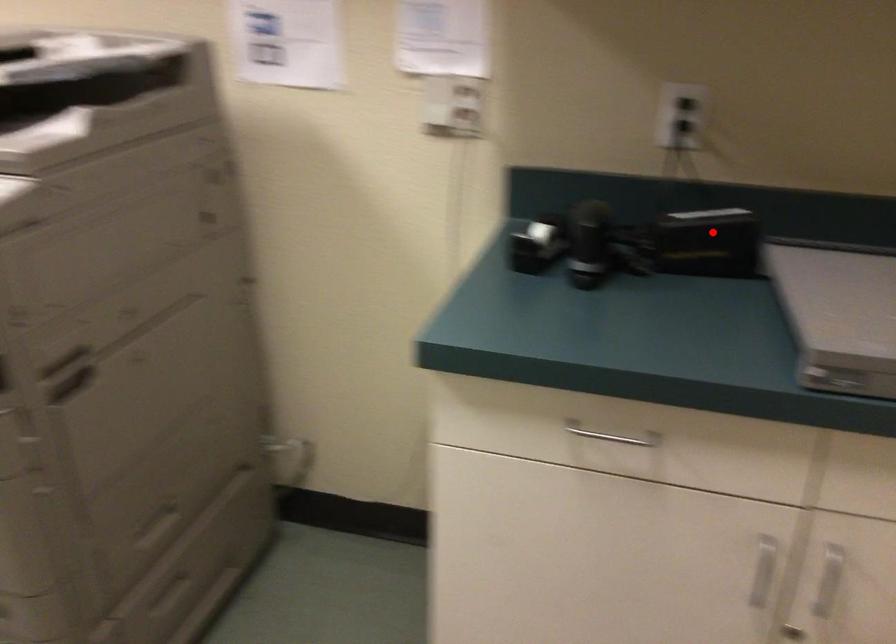
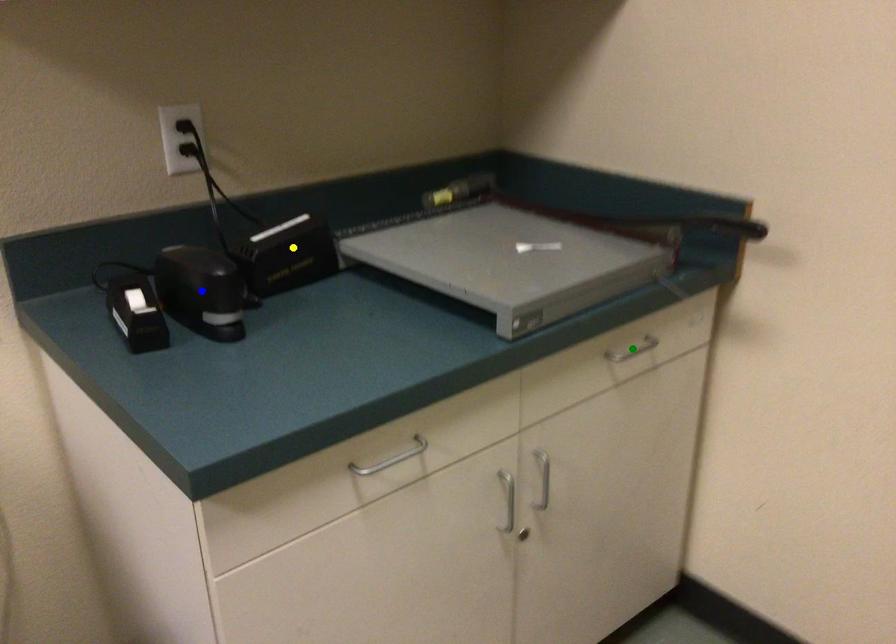
Question: I am providing you with two images of the same scene from different viewpoints. A red point is marked on the first image. You are given multiple points on the second image. Which point in image 2 is actually the same real-world point as the red point in image 1?

Choices:
 (A) green point
 (B) blue point
 (C) yellow point

Answer: (C)